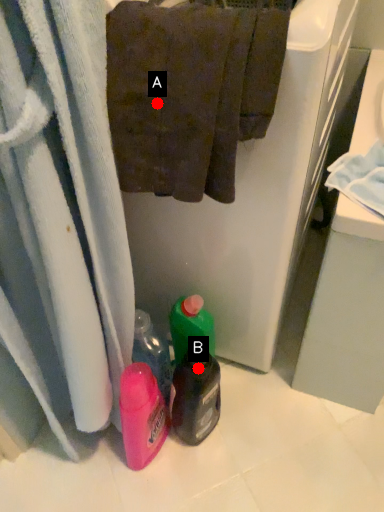
Question: Two points are circled on the image, labeled by A and B beside each circle. Which point is farther from the camera taking this photo?

Choices:
 (A) A is further
 (B) B is further

Answer: (B)